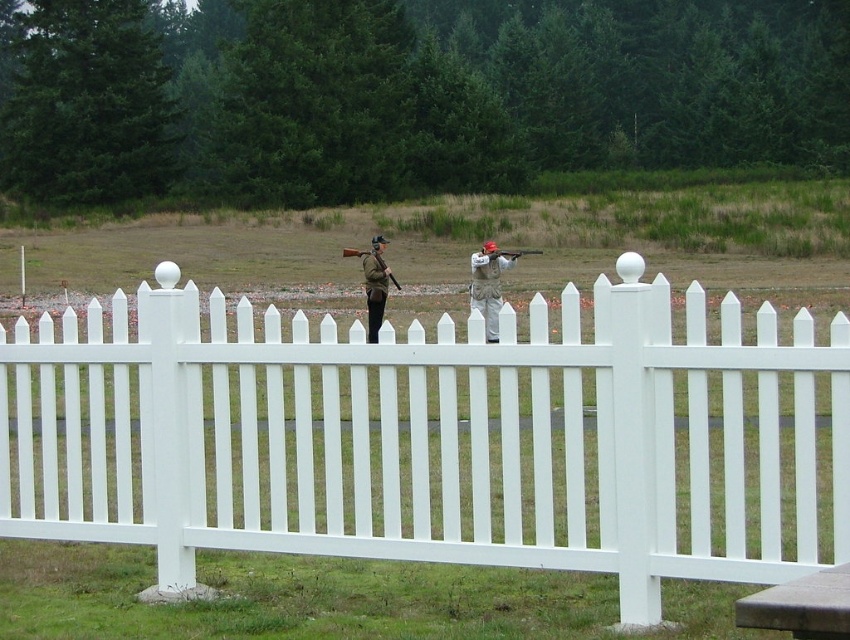
You are standing at the origin point of the coordinate system. You want to walk to the white picket fence at center. Which direction should you move in?

The white picket fence at center is located at coordinate point 0.684 in the x direction and 0.513 in the y direction. Since you are at the origin, you should move in the positive x and positive y directions to reach it.

You are a photographer positioned at the origin point. You need to capture a photo of the khaki fabric uniform at center. What are the coordinates where you should focus your camera?

The khaki fabric uniform at center is located at coordinates (488, 284). Therefore, the camera should focus on point (488, 284) to capture the khaki fabric uniform at center.

You are a visitor at a shooting range and see the white picket fence at center and the camouflage fabric uniform at center. According to the scene, which object is positioned to the left?

The camouflage fabric uniform at center is positioned to the left of the white picket fence at center.